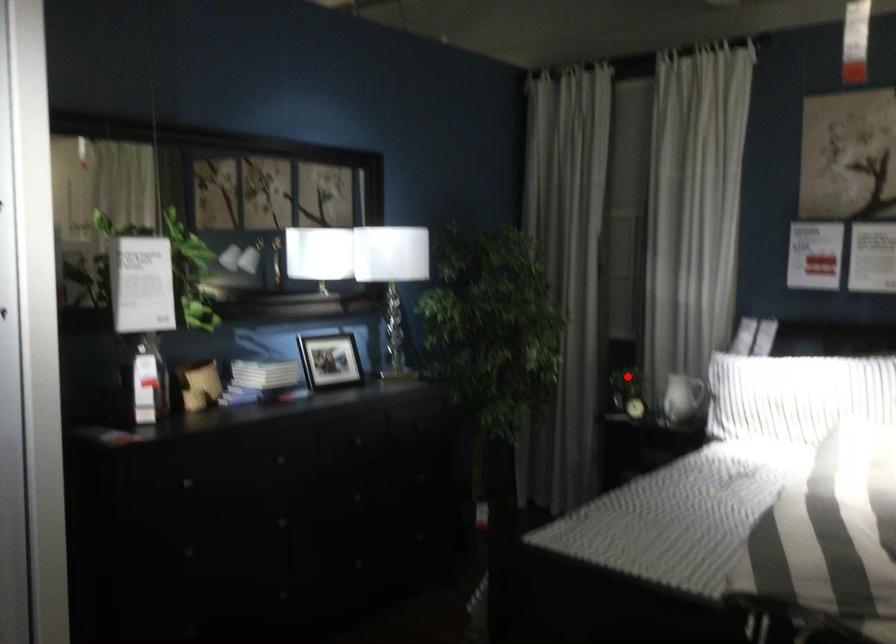
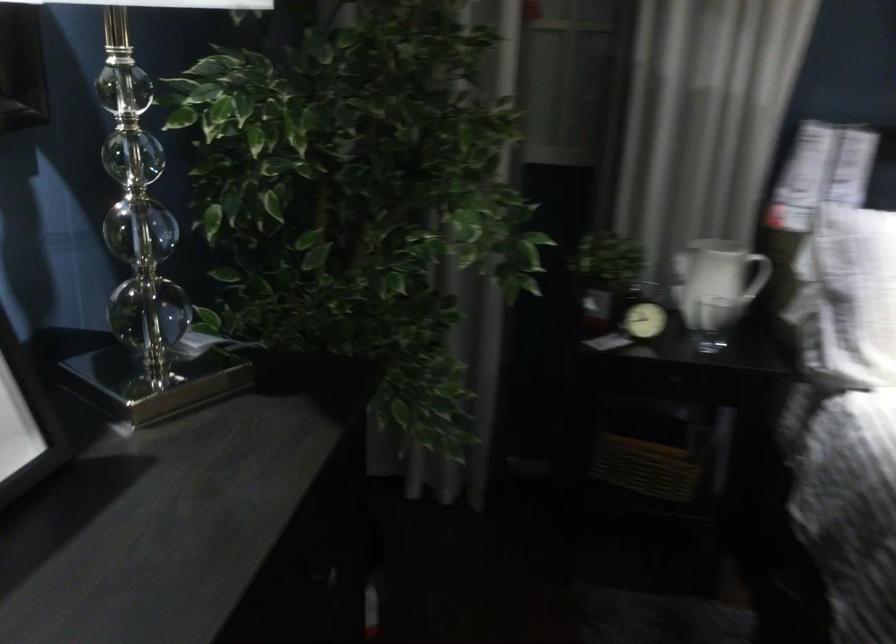
Question: I am providing you with two images of the same scene from different viewpoints. A red point is marked on the first image. Can you still see the location of the red point in image 2?

Choices:
 (A) Yes
 (B) No

Answer: (A)